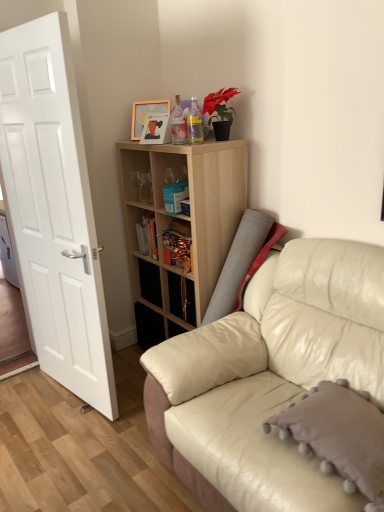
Describe the element at coordinates (147, 236) in the screenshot. The height and width of the screenshot is (512, 384). I see `hardcover book at center, placed as the 2th book when sorted from front to back` at that location.

Where is `hardcover book at center, the 2th book viewed from the top`? The height and width of the screenshot is (512, 384). hardcover book at center, the 2th book viewed from the top is located at coordinates click(147, 236).

The height and width of the screenshot is (512, 384). What do you see at coordinates (175, 197) in the screenshot?
I see `blue matte bookshelf at center, which is the 1th book in top-to-bottom order` at bounding box center [175, 197].

At what (x,y) coordinates should I click in order to perform the action: click on clear glass bottle at upper center, placed as the 1th bottle when sorted from right to left. Please return your answer as a coordinate pair (x, y). The image size is (384, 512). Looking at the image, I should click on (195, 123).

The width and height of the screenshot is (384, 512). Find the location of `gray fluffy pillow at lower right`. gray fluffy pillow at lower right is located at coordinates (339, 435).

Measure the distance between translucent plastic bottle at upper center, the 1th bottle positioned from the left, and camera.

translucent plastic bottle at upper center, the 1th bottle positioned from the left, and camera are 2.19 meters apart from each other.

Based on the photo, how much space does translucent plastic bottle at upper center, which is the 2th bottle in right-to-left order, occupy vertically?

translucent plastic bottle at upper center, which is the 2th bottle in right-to-left order, is 9.80 inches in height.

Measure the distance between point (x=146, y=154) and camera.

The depth of point (x=146, y=154) is 8.95 feet.

Where is `light wood/texture bookshelf at upper center`? light wood/texture bookshelf at upper center is located at coordinates (180, 227).

Describe the element at coordinates (146, 114) in the screenshot. The image size is (384, 512). I see `matte plastic picture frame at upper center` at that location.

You are a GUI agent. You are given a task and a screenshot of the screen. Output one action in this format:
    pyautogui.click(x=<x>, y=<y>)
    Task: Click on the white matte door at left
    The height and width of the screenshot is (512, 384).
    Given the screenshot: What is the action you would take?
    pyautogui.click(x=54, y=209)

How different are the orientations of leather couch at right and blue matte bookshelf at center, acting as the 2th book starting from the bottom, in degrees?

leather couch at right and blue matte bookshelf at center, acting as the 2th book starting from the bottom, are facing 5.96 degrees away from each other.

In the image, is leather couch at right on the left side or the right side of blue matte bookshelf at center, acting as the second book starting from the left?

leather couch at right is to the right of blue matte bookshelf at center, acting as the second book starting from the left.

You are a GUI agent. You are given a task and a screenshot of the screen. Output one action in this format:
    pyautogui.click(x=<x>, y=<y>)
    Task: Click on the 1st book behind the leather couch at right
    
    Given the screenshot: What is the action you would take?
    pyautogui.click(x=175, y=197)

Relative to blue matte bookshelf at center, positioned as the 2th book in back-to-front order, is leather couch at right in front or behind?

Clearly, leather couch at right is in front of blue matte bookshelf at center, positioned as the 2th book in back-to-front order.

Between point (149, 215) and point (312, 508), which one is positioned behind?

The point (149, 215) is more distant.

Would you say hardcover book at center, the 1th book in the back-to-front sequence, contains leather couch at right?

No, leather couch at right is located outside of hardcover book at center, the 1th book in the back-to-front sequence.

In terms of height, does hardcover book at center, the 2th book viewed from the top, look taller or shorter compared to leather couch at right?

hardcover book at center, the 2th book viewed from the top, is shorter than leather couch at right.

How many degrees apart are the facing directions of matte plastic picture frame at upper center and clear glass bottle at upper center, arranged as the 2th bottle when viewed from the left?

The facing directions of matte plastic picture frame at upper center and clear glass bottle at upper center, arranged as the 2th bottle when viewed from the left, are 0.781 degrees apart.

Is there a large distance between matte plastic picture frame at upper center and clear glass bottle at upper center, placed as the 1th bottle when sorted from right to left?

No, there isn't a large distance between matte plastic picture frame at upper center and clear glass bottle at upper center, placed as the 1th bottle when sorted from right to left.

From a real-world perspective, which is physically above, matte plastic picture frame at upper center or clear glass bottle at upper center, placed as the 1th bottle when sorted from right to left?

matte plastic picture frame at upper center, from a real-world perspective.

Who is smaller, matte plastic picture frame at upper center or clear glass bottle at upper center, placed as the 1th bottle when sorted from right to left?

clear glass bottle at upper center, placed as the 1th bottle when sorted from right to left.

Considering the sizes of objects gray fluffy pillow at lower right and clear glass bottle at upper center, placed as the 1th bottle when sorted from right to left, in the image provided, who is bigger, gray fluffy pillow at lower right or clear glass bottle at upper center, placed as the 1th bottle when sorted from right to left,?

gray fluffy pillow at lower right.

This screenshot has width=384, height=512. In order to click on the 1st bottle above the gray fluffy pillow at lower right (from a real-world perspective) in this screenshot , I will do `click(195, 123)`.

In the scene shown: Considering the sizes of gray fluffy pillow at lower right and clear glass bottle at upper center, placed as the 1th bottle when sorted from right to left, in the image, is gray fluffy pillow at lower right taller or shorter than clear glass bottle at upper center, placed as the 1th bottle when sorted from right to left,?

Considering their sizes, gray fluffy pillow at lower right has less height than clear glass bottle at upper center, placed as the 1th bottle when sorted from right to left.

Is gray fluffy pillow at lower right directly adjacent to clear glass bottle at upper center, placed as the 1th bottle when sorted from right to left?

There is a gap between gray fluffy pillow at lower right and clear glass bottle at upper center, placed as the 1th bottle when sorted from right to left.

Looking at this image, how different are the orientations of hardcover book at center, the 1th book in the back-to-front sequence, and gray fluffy pillow at lower right in degrees?

The angular difference between hardcover book at center, the 1th book in the back-to-front sequence, and gray fluffy pillow at lower right is 0.158 degrees.

From a real-world perspective, is hardcover book at center, which is counted as the 1th book, starting from the left, below gray fluffy pillow at lower right?

No, from a real-world perspective, hardcover book at center, which is counted as the 1th book, starting from the left, is not below gray fluffy pillow at lower right.

Which of these two, hardcover book at center, the second book from the right, or gray fluffy pillow at lower right, stands taller?

hardcover book at center, the second book from the right, is taller.

Is hardcover book at center, which is counted as the 1th book, starting from the left, smaller than gray fluffy pillow at lower right?

Indeed, hardcover book at center, which is counted as the 1th book, starting from the left, has a smaller size compared to gray fluffy pillow at lower right.

Which is more to the left, hardcover book at center, the second book from the right, or blue matte bookshelf at center, acting as the second book starting from the left?

From the viewer's perspective, hardcover book at center, the second book from the right, appears more on the left side.

How different are the orientations of hardcover book at center, the 2th book viewed from the top, and blue matte bookshelf at center, positioned as the 2th book in back-to-front order, in degrees?

The angular difference between hardcover book at center, the 2th book viewed from the top, and blue matte bookshelf at center, positioned as the 2th book in back-to-front order, is 5.8 degrees.

Is point (142, 217) less distant than point (175, 203)?

That is False.

Is hardcover book at center, the 1th book in the back-to-front sequence, touching blue matte bookshelf at center, marked as the first book in a front-to-back arrangement?

hardcover book at center, the 1th book in the back-to-front sequence, and blue matte bookshelf at center, marked as the first book in a front-to-back arrangement, are not in contact.

Does point (176, 205) lie in front of point (151, 266)?

Yes, point (176, 205) is in front of point (151, 266).

Considering the relative sizes of blue matte bookshelf at center, which is the 1th book in top-to-bottom order, and black matte drawer at center in the image provided, is blue matte bookshelf at center, which is the 1th book in top-to-bottom order, smaller than black matte drawer at center?

Yes.

From a real-world perspective, is blue matte bookshelf at center, which is the 1th book in top-to-bottom order, located beneath black matte drawer at center?

No, from a real-world perspective, blue matte bookshelf at center, which is the 1th book in top-to-bottom order, is not below black matte drawer at center.

Where is `drawer below the blue matte bookshelf at center, acting as the 2th book starting from the bottom (from a real-world perspective)`? This screenshot has height=512, width=384. drawer below the blue matte bookshelf at center, acting as the 2th book starting from the bottom (from a real-world perspective) is located at coordinates point(150,282).

Locate an element on the screen. This screenshot has width=384, height=512. studio couch located in front of the blue matte bookshelf at center, acting as the second book starting from the left is located at coordinates (271, 374).

Where is `studio couch that appears on the right of hardcover book at center, the second book from the right`? studio couch that appears on the right of hardcover book at center, the second book from the right is located at coordinates (271, 374).

Looking at the image, which one is located closer to gray fluffy pillow at lower right, blue matte bookshelf at center, the first book viewed from the right, or clear glass bottle at upper center, arranged as the 2th bottle when viewed from the left?

blue matte bookshelf at center, the first book viewed from the right, lies closer to gray fluffy pillow at lower right than the other object.

Considering their positions, is gray fluffy pillow at lower right positioned closer to translucent plastic bottle at upper center, which is the 2th bottle in right-to-left order, than light wood/texture bookshelf at upper center?

light wood/texture bookshelf at upper center lies closer to translucent plastic bottle at upper center, which is the 2th bottle in right-to-left order, than the other object.

Looking at the image, which one is located closer to matte plastic picture frame at upper center, black matte drawer at center or translucent plastic bottle at upper center, the 1th bottle positioned from the left?

translucent plastic bottle at upper center, the 1th bottle positioned from the left, lies closer to matte plastic picture frame at upper center than the other object.

From the image, which object appears to be nearer to gray fluffy pillow at lower right, black matte drawer at center or leather couch at right?

leather couch at right.

Looking at the image, which one is located closer to translucent plastic bottle at upper center, the 1th bottle positioned from the left, white matte door at left or black matte drawer at center?

The object closer to translucent plastic bottle at upper center, the 1th bottle positioned from the left, is white matte door at left.

Which object lies further to the anchor point translucent plastic bottle at upper center, the 1th bottle positioned from the left, clear glass bottle at upper center, arranged as the 2th bottle when viewed from the left, or white matte door at left?

A: white matte door at left lies further to translucent plastic bottle at upper center, the 1th bottle positioned from the left, than the other object.

From the image, which object appears to be nearer to gray fluffy pillow at lower right, matte plastic picture frame at upper center or blue matte bookshelf at center, acting as the second book starting from the left?

blue matte bookshelf at center, acting as the second book starting from the left, is closer to gray fluffy pillow at lower right.

From the image, which object appears to be farther from matte plastic picture frame at upper center, white matte door at left or hardcover book at center, the 1th book positioned from the bottom?

white matte door at left lies further to matte plastic picture frame at upper center than the other object.

Where is `book between white matte door at left and matte plastic picture frame at upper center along the z-axis`? The image size is (384, 512). book between white matte door at left and matte plastic picture frame at upper center along the z-axis is located at coordinates (175, 197).

Where is `book positioned between gray fluffy pillow at lower right and hardcover book at center, placed as the 2th book when sorted from front to back, from near to far`? This screenshot has width=384, height=512. book positioned between gray fluffy pillow at lower right and hardcover book at center, placed as the 2th book when sorted from front to back, from near to far is located at coordinates (175, 197).

Image resolution: width=384 pixels, height=512 pixels. Identify the location of door located between gray fluffy pillow at lower right and black matte drawer at center in the depth direction. (54, 209).

Identify the location of book positioned between clear glass bottle at upper center, placed as the 1th bottle when sorted from right to left, and hardcover book at center, the 1th book positioned from the bottom, from near to far. (175, 197).